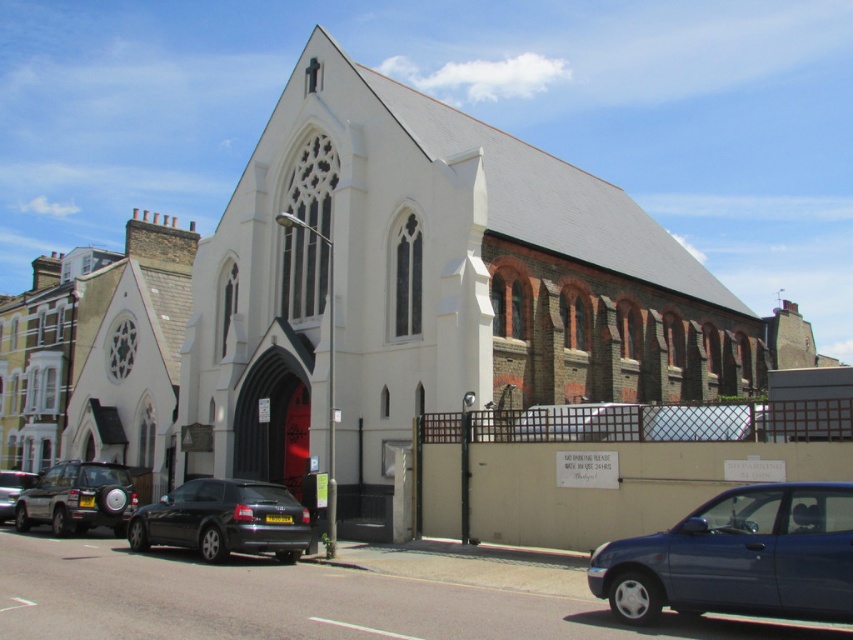
Image resolution: width=853 pixels, height=640 pixels. Describe the element at coordinates (224, 520) in the screenshot. I see `glossy black car at lower left` at that location.

Which is behind, point (303, 522) or point (126, 481)?

Positioned behind is point (126, 481).

Measure the distance between glossy black car at lower left and camera.

36.88 meters

Image resolution: width=853 pixels, height=640 pixels. I want to click on glossy black car at lower left, so click(224, 520).

Which of these two, silver metallic suv at left or matte black car at lower left, stands shorter?

silver metallic suv at left

Between point (80, 467) and point (6, 516), which one is positioned behind?

The point (6, 516) is more distant.

The height and width of the screenshot is (640, 853). In order to click on silver metallic suv at left in this screenshot , I will do `click(78, 499)`.

Is point (300, 275) more distant than point (33, 481)?

Yes.

Can you confirm if white stone chapel at center is positioned to the right of matte black car at lower left?

Yes, white stone chapel at center is to the right of matte black car at lower left.

Between point (426, 365) and point (3, 483), which one is positioned in front?

Point (426, 365)

In order to click on white stone chapel at center in this screenshot , I will do tap(428, 285).